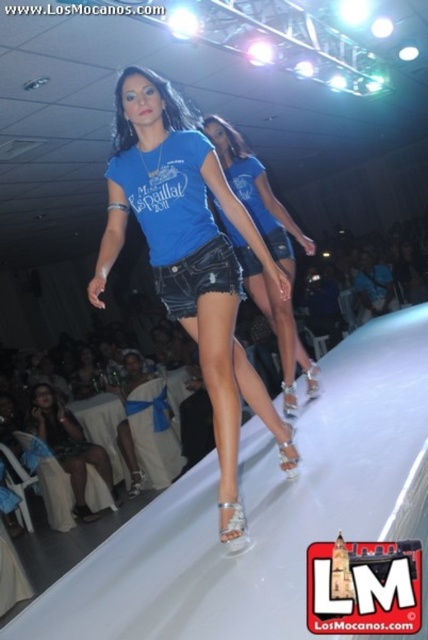
Is matte black dress at lower left above denim shorts at center?

No.

Can you confirm if matte black dress at lower left is smaller than denim shorts at center?

Actually, matte black dress at lower left might be larger than denim shorts at center.

Which is in front, point (59, 451) or point (225, 257)?

Point (225, 257) is in front.

This screenshot has width=428, height=640. I want to click on matte black dress at lower left, so click(x=71, y=449).

Consider the image. Does blue denim shorts at center appear under matte black dress at lower left?

Incorrect, blue denim shorts at center is not positioned below matte black dress at lower left.

Is point (217, 124) behind point (53, 420)?

No, it is in front of (53, 420).

Locate an element on the screen. The width and height of the screenshot is (428, 640). blue denim shorts at center is located at coordinates (255, 193).

Who is higher up, matte blue denim shorts at center or matte black dress at lower left?

Positioned higher is matte blue denim shorts at center.

Where is `matte blue denim shorts at center`? Image resolution: width=428 pixels, height=640 pixels. matte blue denim shorts at center is located at coordinates (190, 260).

This screenshot has width=428, height=640. What do you see at coordinates (190, 260) in the screenshot?
I see `matte blue denim shorts at center` at bounding box center [190, 260].

Identify the location of matte blue denim shorts at center. (190, 260).